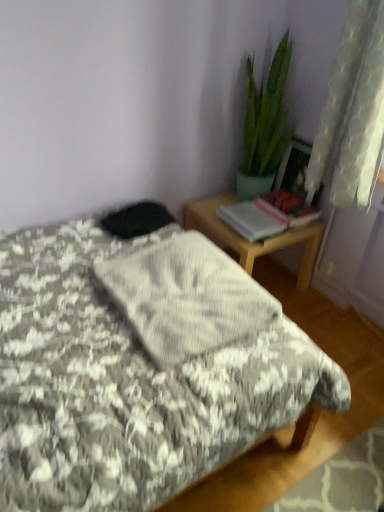
Question: Is the depth of fluffy gray blanket at center greater than that of white sheer curtain at upper right?

Choices:
 (A) no
 (B) yes

Answer: (A)

Question: Is fluffy gray blanket at center thinner than white sheer curtain at upper right?

Choices:
 (A) yes
 (B) no

Answer: (B)

Question: Does fluffy gray blanket at center have a greater width compared to white sheer curtain at upper right?

Choices:
 (A) yes
 (B) no

Answer: (A)

Question: From the image's perspective, is fluffy gray blanket at center under white sheer curtain at upper right?

Choices:
 (A) no
 (B) yes

Answer: (B)

Question: Does fluffy gray blanket at center come in front of white sheer curtain at upper right?

Choices:
 (A) yes
 (B) no

Answer: (A)

Question: Is fluffy gray blanket at center to the right of white sheer curtain at upper right from the viewer's perspective?

Choices:
 (A) no
 (B) yes

Answer: (A)

Question: Can we say white sheer curtain at upper right lies outside green glossy plant at upper right?

Choices:
 (A) yes
 (B) no

Answer: (A)

Question: Is white sheer curtain at upper right thinner than green glossy plant at upper right?

Choices:
 (A) yes
 (B) no

Answer: (A)

Question: Is white sheer curtain at upper right turned away from green glossy plant at upper right?

Choices:
 (A) no
 (B) yes

Answer: (A)

Question: Is the depth of white sheer curtain at upper right less than that of green glossy plant at upper right?

Choices:
 (A) yes
 (B) no

Answer: (A)

Question: Is white sheer curtain at upper right oriented towards green glossy plant at upper right?

Choices:
 (A) no
 (B) yes

Answer: (A)

Question: Is white sheer curtain at upper right shorter than green glossy plant at upper right?

Choices:
 (A) no
 (B) yes

Answer: (B)

Question: Does gray textured blanket at center appear on the left side of wooden desk at right?

Choices:
 (A) no
 (B) yes

Answer: (B)